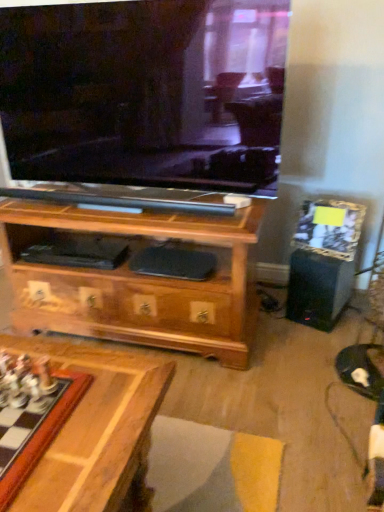
Where is `wooden chessboard at lower left`? Image resolution: width=384 pixels, height=512 pixels. wooden chessboard at lower left is located at coordinates (35, 424).

What do you see at coordinates (35, 424) in the screenshot? This screenshot has height=512, width=384. I see `wooden chessboard at lower left` at bounding box center [35, 424].

Find the location of a particular element. Image resolution: width=384 pixels, height=512 pixels. black plastic speaker at right is located at coordinates (318, 289).

Measure the distance between black plastic speaker at right and camera.

black plastic speaker at right and camera are 1.89 meters apart from each other.

The width and height of the screenshot is (384, 512). What do you see at coordinates (318, 289) in the screenshot?
I see `black plastic speaker at right` at bounding box center [318, 289].

Image resolution: width=384 pixels, height=512 pixels. I want to click on wooden chessboard at lower left, so click(x=35, y=424).

Which is more to the left, wooden chessboard at lower left or black plastic speaker at right?

wooden chessboard at lower left is more to the left.

Is wooden chessboard at lower left in front of black plastic speaker at right?

That is True.

Between point (7, 355) and point (330, 268), which one is positioned behind?

Point (330, 268)

From the image's perspective, would you say wooden chessboard at lower left is shown under black plastic speaker at right?

Indeed, from the image's perspective, wooden chessboard at lower left is shown beneath black plastic speaker at right.

From a real-world perspective, is wooden chessboard at lower left physically below black plastic speaker at right?

No, from a real-world perspective, wooden chessboard at lower left is not under black plastic speaker at right.

Does wooden chessboard at lower left have a lesser width compared to black plastic speaker at right?

In fact, wooden chessboard at lower left might be wider than black plastic speaker at right.

In the scene shown: Which of these two, wooden chessboard at lower left or black plastic speaker at right, stands taller?

black plastic speaker at right is taller.

Which of these two, wooden chessboard at lower left or black plastic speaker at right, is bigger?

black plastic speaker at right.

Would you say wooden chessboard at lower left is outside black plastic speaker at right?

Absolutely, wooden chessboard at lower left is external to black plastic speaker at right.

Is wooden chessboard at lower left next to black plastic speaker at right?

wooden chessboard at lower left and black plastic speaker at right are clearly separated.

Could you tell me if wooden chessboard at lower left is turned towards black plastic speaker at right?

No, wooden chessboard at lower left is not facing towards black plastic speaker at right.

How many degrees apart are the facing directions of wooden chessboard at lower left and black plastic speaker at right?

20.7 degrees separate the facing orientations of wooden chessboard at lower left and black plastic speaker at right.

Identify the location of speaker located underneath the wooden chessboard at lower left (from a real-world perspective). The image size is (384, 512). (318, 289).

Is black plastic speaker at right to the right of wooden chessboard at lower left from the viewer's perspective?

Indeed, black plastic speaker at right is positioned on the right side of wooden chessboard at lower left.

Considering the positions of objects black plastic speaker at right and wooden chessboard at lower left in the image provided, who is behind, black plastic speaker at right or wooden chessboard at lower left?

black plastic speaker at right is further away from the camera.

Between point (332, 264) and point (6, 430), which one is positioned behind?

Point (332, 264)

From the image's perspective, which is above, black plastic speaker at right or wooden chessboard at lower left?

black plastic speaker at right is shown above in the image.

From a real-world perspective, is black plastic speaker at right positioned above or below wooden chessboard at lower left?

black plastic speaker at right is situated lower than wooden chessboard at lower left in the real world.

Between black plastic speaker at right and wooden chessboard at lower left, which one has smaller width?

black plastic speaker at right is thinner.

Considering the relative sizes of black plastic speaker at right and wooden chessboard at lower left in the image provided, is black plastic speaker at right shorter than wooden chessboard at lower left?

No.

Considering the sizes of black plastic speaker at right and wooden chessboard at lower left in the image, is black plastic speaker at right bigger or smaller than wooden chessboard at lower left?

In the image, black plastic speaker at right appears to be larger than wooden chessboard at lower left.

Is wooden chessboard at lower left completely or partially inside black plastic speaker at right?

Actually, wooden chessboard at lower left is outside black plastic speaker at right.

Consider the image. Is black plastic speaker at right positioned far away from wooden chessboard at lower left?

Yes, black plastic speaker at right and wooden chessboard at lower left are located far from each other.

Could you tell me if black plastic speaker at right is turned towards wooden chessboard at lower left?

Yes, black plastic speaker at right is oriented towards wooden chessboard at lower left.

How different are the orientations of black plastic speaker at right and wooden chessboard at lower left in degrees?

20.7 degrees.

Measure the distance from black plastic speaker at right to wooden chessboard at lower left.

black plastic speaker at right and wooden chessboard at lower left are 4.30 feet apart.

What are the coordinates of `speaker located on the right of wooden chessboard at lower left` in the screenshot? It's located at (318, 289).

Identify the location of speaker on the right of wooden chessboard at lower left. (318, 289).

Identify the location of speaker directly beneath the wooden chessboard at lower left (from a real-world perspective). (318, 289).